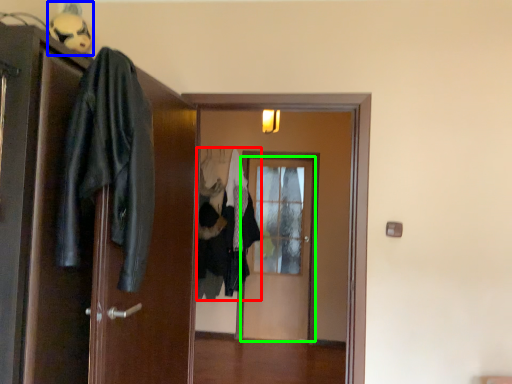
Question: Which is nearer to the clothing (highlighted by a red box)? figurine (highlighted by a blue box) or door (highlighted by a green box).

Choices:
 (A) figurine
 (B) door

Answer: (B)